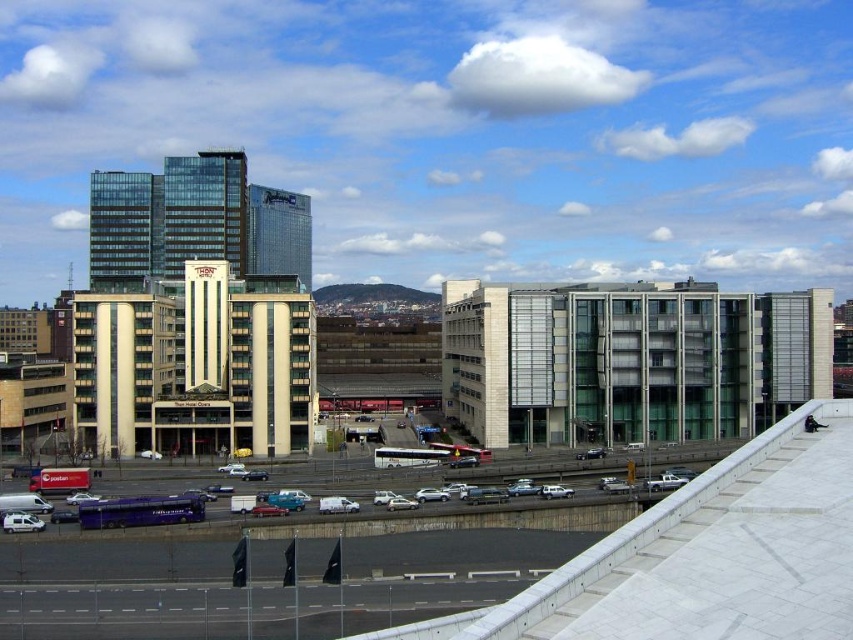
Question: Is white matte van at lower left behind white matte car at center?

Choices:
 (A) no
 (B) yes

Answer: (A)

Question: Which point is farther from the camera taking this photo?

Choices:
 (A) (405, 502)
 (B) (16, 524)
 (C) (169, 532)

Answer: (A)

Question: Which of the following is the closest to the observer?

Choices:
 (A) white matte car at center
 (B) matte blue bus at center
 (C) white matte van at lower left

Answer: (B)

Question: Is matte blue bus at center positioned before white matte car at center?

Choices:
 (A) no
 (B) yes

Answer: (B)

Question: Which point is closer to the camera?

Choices:
 (A) (397, 499)
 (B) (10, 529)

Answer: (B)

Question: From the image, what is the correct spatial relationship of matte blue bus at center in relation to white matte van at lower left?

Choices:
 (A) left
 (B) right

Answer: (B)